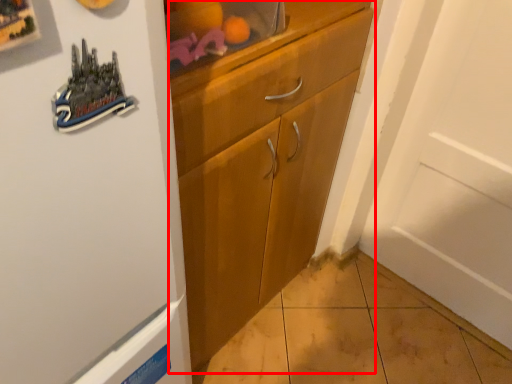
Question: From the image's perspective, where is cabinetry (annotated by the red box) located relative to shelf?

Choices:
 (A) above
 (B) below

Answer: (B)